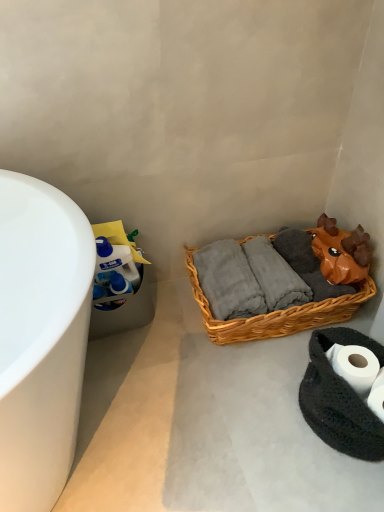
Question: Is there a large distance between black knitted rug at lower right and white matte toilet paper at lower right?

Choices:
 (A) yes
 (B) no

Answer: (B)

Question: Can you confirm if black knitted rug at lower right is taller than white matte toilet paper at lower right?

Choices:
 (A) yes
 (B) no

Answer: (A)

Question: Does black knitted rug at lower right appear on the left side of white matte toilet paper at lower right?

Choices:
 (A) yes
 (B) no

Answer: (B)

Question: From a real-world perspective, is black knitted rug at lower right positioned over white matte toilet paper at lower right based on gravity?

Choices:
 (A) yes
 (B) no

Answer: (B)

Question: Is black knitted rug at lower right smaller than white matte toilet paper at lower right?

Choices:
 (A) yes
 (B) no

Answer: (B)

Question: Is white matte toilet paper at lower right inside or outside of black knitted rug at lower right?

Choices:
 (A) outside
 (B) inside

Answer: (B)

Question: Considering the positions of point (352, 372) and point (334, 416), is point (352, 372) closer or farther from the camera than point (334, 416)?

Choices:
 (A) closer
 (B) farther

Answer: (A)

Question: Is white matte toilet paper at lower right taller or shorter than black knitted rug at lower right?

Choices:
 (A) tall
 (B) short

Answer: (B)

Question: Visually, is white matte toilet paper at lower right positioned to the left or to the right of black knitted rug at lower right?

Choices:
 (A) left
 (B) right

Answer: (A)

Question: Does point (349, 376) appear closer or farther from the camera than point (221, 340)?

Choices:
 (A) closer
 (B) farther

Answer: (A)

Question: Looking at their shapes, would you say white matte toilet paper at lower right is wider or thinner than woven brown basket at center?

Choices:
 (A) wide
 (B) thin

Answer: (B)

Question: Relative to woven brown basket at center, is white matte toilet paper at lower right in front or behind?

Choices:
 (A) behind
 (B) front

Answer: (B)

Question: In terms of height, does white matte toilet paper at lower right look taller or shorter compared to woven brown basket at center?

Choices:
 (A) short
 (B) tall

Answer: (A)

Question: From the image's perspective, relative to white matte toilet paper at lower right, is black knitted rug at lower right above or below?

Choices:
 (A) below
 (B) above

Answer: (A)

Question: From a real-world perspective, relative to white matte toilet paper at lower right, is black knitted rug at lower right vertically above or below?

Choices:
 (A) below
 (B) above

Answer: (A)